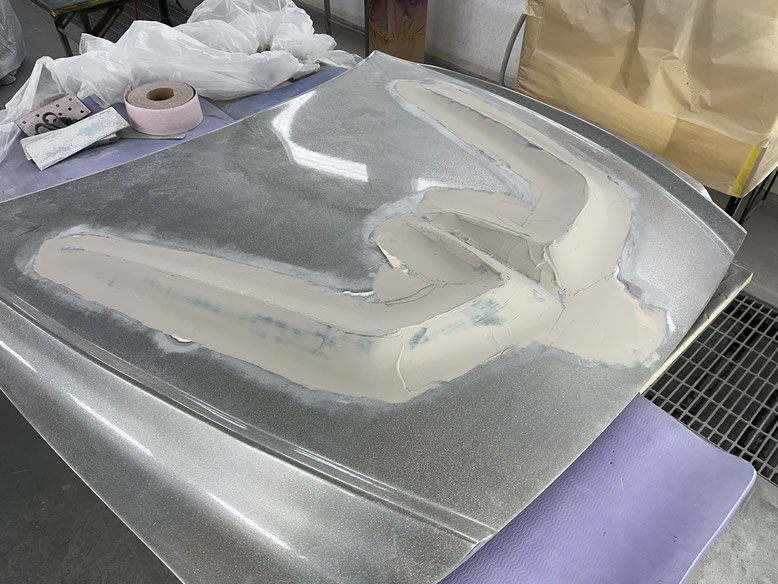
Identify the location of roll of streamers. The height and width of the screenshot is (584, 778). (184, 106).